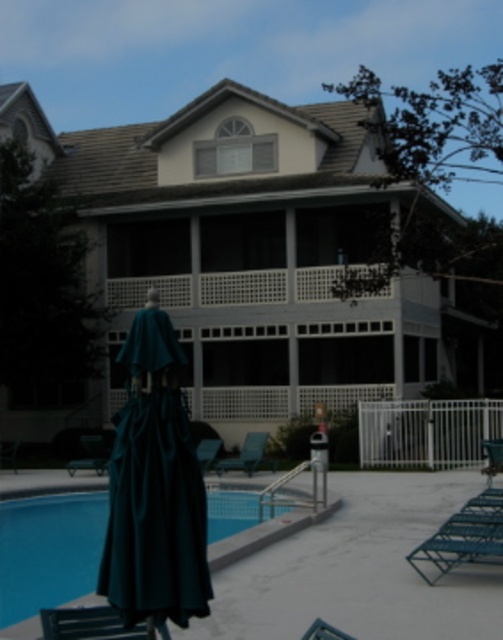
Which is above, metallic blue lounge chair at lower right or teal fabric beach chair at center?

metallic blue lounge chair at lower right

Is point (481, 516) behind point (253, 468)?

No, (481, 516) is closer to viewer.

This screenshot has width=503, height=640. In order to click on metallic blue lounge chair at lower right in this screenshot , I will do [464, 536].

Looking at this image, can you confirm if blue glossy pool at lower left is shorter than teal fabric beach chair at lower left?

No.

In the scene shown: Does blue glossy pool at lower left lie in front of teal fabric beach chair at lower left?

Yes, blue glossy pool at lower left is closer to the viewer.

Between point (14, 577) and point (107, 458), which one is positioned behind?

The point (107, 458) is more distant.

This screenshot has width=503, height=640. I want to click on blue glossy pool at lower left, so click(45, 573).

Is teal fabric beach chair at center bigger than teal fabric beach chair at lower left?

Correct, teal fabric beach chair at center is larger in size than teal fabric beach chair at lower left.

Is teal fabric beach chair at center behind teal fabric beach chair at lower left?

That is False.

Between point (225, 465) and point (104, 465), which one is positioned in front?

Point (225, 465) is in front.

You are a GUI agent. You are given a task and a screenshot of the screen. Output one action in this format:
    pyautogui.click(x=<x>, y=<y>)
    Task: Click on the teal fabric beach chair at center
    
    Given the screenshot: What is the action you would take?
    pyautogui.click(x=245, y=454)